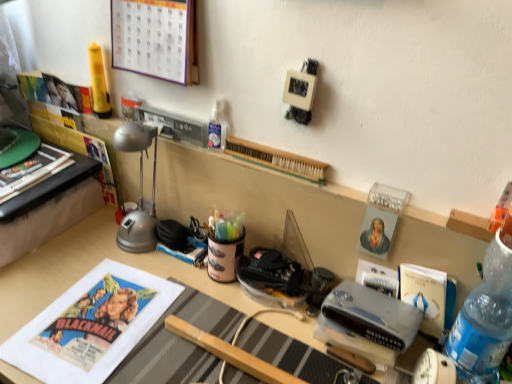
How much space does hardcover book at center, positioned as the second paperback book in right-to-left order, occupy vertically?

It is 4.05 inches.

Identify the location of silver metallic desk lamp at left. (140, 190).

Locate an element on the screen. wooden toothbrush at center is located at coordinates (277, 160).

Measure the distance between wooden toothbrush at center and camera.

A distance of 32.31 inches exists between wooden toothbrush at center and camera.

What do you see at coordinates (152, 38) in the screenshot?
I see `matte paper calendar at upper left` at bounding box center [152, 38].

In order to face white paper poster at center, should I rotate leftwards or rightwards?

You should rotate left by 20.545 degrees.

I want to click on blue plastic bottle at right, so click(x=485, y=315).

Identify the location of blue matte paperback book at center-right, the second paperback book positioned from the left. (425, 295).

Could you tell me if blue matte paperback book at center-right, which is the 1th paperback book from right to left, is facing silver metallic desk lamp at left?

No, blue matte paperback book at center-right, which is the 1th paperback book from right to left, is not aimed at silver metallic desk lamp at left.

Is blue matte paperback book at center-right, the second paperback book positioned from the left, far from silver metallic desk lamp at left?

No, blue matte paperback book at center-right, the second paperback book positioned from the left, is not far from silver metallic desk lamp at left.

At what (x,y) coordinates should I click in order to perform the action: click on the 2nd paperback book to the right of the silver metallic desk lamp at left, counting from the anchor's position. Please return your answer as a coordinate pair (x, y). The height and width of the screenshot is (384, 512). Looking at the image, I should click on (425, 295).

From a real-world perspective, is blue matte paperback book at center-right, the second paperback book positioned from the left, above or below silver metallic desk lamp at left?

blue matte paperback book at center-right, the second paperback book positioned from the left, is situated lower than silver metallic desk lamp at left in the real world.

Which object is positioned more to the left, hardcover book at center, placed as the first paperback book when sorted from left to right, or silver metallic desk lamp at left?

silver metallic desk lamp at left is more to the left.

Is hardcover book at center, placed as the first paperback book when sorted from left to right, turned away from silver metallic desk lamp at left?

hardcover book at center, placed as the first paperback book when sorted from left to right, is not turned away from silver metallic desk lamp at left.

Is silver metallic desk lamp at left surrounded by hardcover book at center, positioned as the second paperback book in right-to-left order?

That's incorrect, silver metallic desk lamp at left is not inside hardcover book at center, positioned as the second paperback book in right-to-left order.

The image size is (512, 384). What are the coordinates of `table lamp above the hardcover book at center, placed as the first paperback book when sorted from left to right (from a real-world perspective)` in the screenshot? It's located at (140, 190).

Are wooden toothbrush at center and wooden desk at center making contact?

No, wooden toothbrush at center is not next to wooden desk at center.

Looking at this image, is wooden toothbrush at center positioned with its back to wooden desk at center?

No, wooden toothbrush at center is not facing away from wooden desk at center.

Measure the distance from wooden toothbrush at center to wooden desk at center.

wooden toothbrush at center is 15.23 inches from wooden desk at center.

Based on their sizes in the image, would you say wooden toothbrush at center is bigger or smaller than wooden desk at center?

Considering their sizes, wooden toothbrush at center takes up less space than wooden desk at center.

Does silver metallic desk lamp at left have a greater width compared to blue plastic bottle at right?

Incorrect, the width of silver metallic desk lamp at left does not surpass that of blue plastic bottle at right.

Considering the points (152, 195) and (510, 267), which point is behind, point (152, 195) or point (510, 267)?

The point (152, 195) is behind.

From the picture: From a real-world perspective, which is physically above, silver metallic desk lamp at left or blue plastic bottle at right?

blue plastic bottle at right.

Can we say silver metallic desk lamp at left lies outside blue plastic bottle at right?

Absolutely, silver metallic desk lamp at left is external to blue plastic bottle at right.

What's the angular difference between wooden toothbrush at center and silver metallic desk lamp at left's facing directions?

wooden toothbrush at center and silver metallic desk lamp at left are facing 7.69 degrees away from each other.

Which object is wider, wooden toothbrush at center or silver metallic desk lamp at left?

silver metallic desk lamp at left.

Does wooden toothbrush at center turn towards silver metallic desk lamp at left?

No, wooden toothbrush at center does not turn towards silver metallic desk lamp at left.

Are matte paper calendar at upper left and hardcover book at center, positioned as the second paperback book in right-to-left order, beside each other?

No, matte paper calendar at upper left is not next to hardcover book at center, positioned as the second paperback book in right-to-left order.

From the image's perspective, relative to hardcover book at center, placed as the first paperback book when sorted from left to right, is matte paper calendar at upper left above or below?

From the image's perspective, matte paper calendar at upper left appears above hardcover book at center, placed as the first paperback book when sorted from left to right.

Is matte paper calendar at upper left taller or shorter than hardcover book at center, placed as the first paperback book when sorted from left to right?

Clearly, matte paper calendar at upper left is taller compared to hardcover book at center, placed as the first paperback book when sorted from left to right.

From a real-world perspective, which is physically below, matte paper calendar at upper left or hardcover book at center, placed as the first paperback book when sorted from left to right?

hardcover book at center, placed as the first paperback book when sorted from left to right, is physically lower.

Identify the location of the 2nd paperback book behind when counting from the white paper poster at center. (377, 278).

Is white paper poster at center a part of hardcover book at center, placed as the first paperback book when sorted from left to right?

Definitely not — white paper poster at center is not inside hardcover book at center, placed as the first paperback book when sorted from left to right.

Is hardcover book at center, placed as the first paperback book when sorted from left to right, facing away from white paper poster at center?

No, white paper poster at center is not at the back of hardcover book at center, placed as the first paperback book when sorted from left to right.

Identify the location of the 2nd paperback book in front of the silver metallic desk lamp at left, starting your count from the anchor. The height and width of the screenshot is (384, 512). point(425,295).

The image size is (512, 384). Identify the location of table lamp lying on the left of hardcover book at center, positioned as the second paperback book in right-to-left order. (140, 190).

When comparing their distances from wooden toothbrush at center, does hardcover book at center, placed as the first paperback book when sorted from left to right, or matte paper calendar at upper left seem closer?

Among the two, hardcover book at center, placed as the first paperback book when sorted from left to right, is located nearer to wooden toothbrush at center.

Looking at the image, which one is located further to blue plastic bottle at right, hardcover book at center, positioned as the second paperback book in right-to-left order, or wooden toothbrush at center?

wooden toothbrush at center is further to blue plastic bottle at right.

From the image, which object appears to be nearer to matte paper calendar at upper left, white paper poster at center or wooden desk at center?

wooden desk at center is positioned closer to the anchor matte paper calendar at upper left.

Based on the photo, based on their spatial positions, is wooden toothbrush at center or matte paper calendar at upper left closer to silver metallic desk lamp at left?

matte paper calendar at upper left.

Which object lies further to the anchor point white paper poster at center, matte paper calendar at upper left or silver metallic desk lamp at left?

matte paper calendar at upper left.

Estimate the real-world distances between objects in this image. Which object is closer to blue plastic bottle at right, wooden desk at center or wooden toothbrush at center?

wooden toothbrush at center is closer to blue plastic bottle at right.

From the image, which object appears to be farther from wooden desk at center, matte paper calendar at upper left or hardcover book at center, positioned as the second paperback book in right-to-left order?

hardcover book at center, positioned as the second paperback book in right-to-left order, is positioned further to the anchor wooden desk at center.

In the scene shown: Which object lies nearer to the anchor point blue matte paperback book at center-right, which is the 1th paperback book from right to left, silver metallic desk lamp at left or wooden desk at center?

wooden desk at center lies closer to blue matte paperback book at center-right, which is the 1th paperback book from right to left, than the other object.

Find the location of a particular element. table lamp situated between white paper poster at center and blue plastic bottle at right from left to right is located at coordinates (140, 190).

Image resolution: width=512 pixels, height=384 pixels. Identify the location of book between matte paper calendar at upper left and wooden desk at center vertically. (277, 160).

Locate an element on the screen. book between silver metallic desk lamp at left and hardcover book at center, placed as the first paperback book when sorted from left to right is located at coordinates (277, 160).

Where is `paperback book between white paper poster at center and blue matte paperback book at center-right, the second paperback book positioned from the left, from left to right`? paperback book between white paper poster at center and blue matte paperback book at center-right, the second paperback book positioned from the left, from left to right is located at coordinates (x=377, y=278).